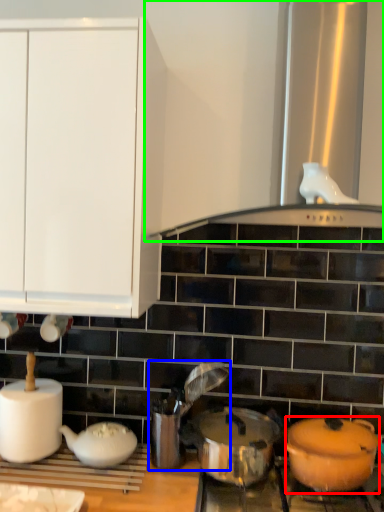
Question: Which object is the closest to the kitchen appliance (highlighted by a red box)? Choose among these: appliance (highlighted by a blue box) or vent (highlighted by a green box).

Choices:
 (A) appliance
 (B) vent

Answer: (A)